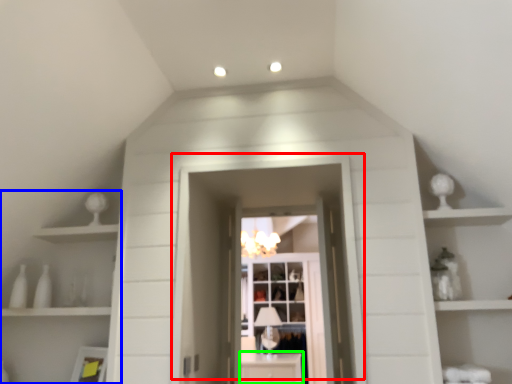
Question: Considering the real-world distances, which object is closest to door (highlighted by a red box)? shelf (highlighted by a blue box) or cabinetry (highlighted by a green box).

Choices:
 (A) shelf
 (B) cabinetry

Answer: (A)